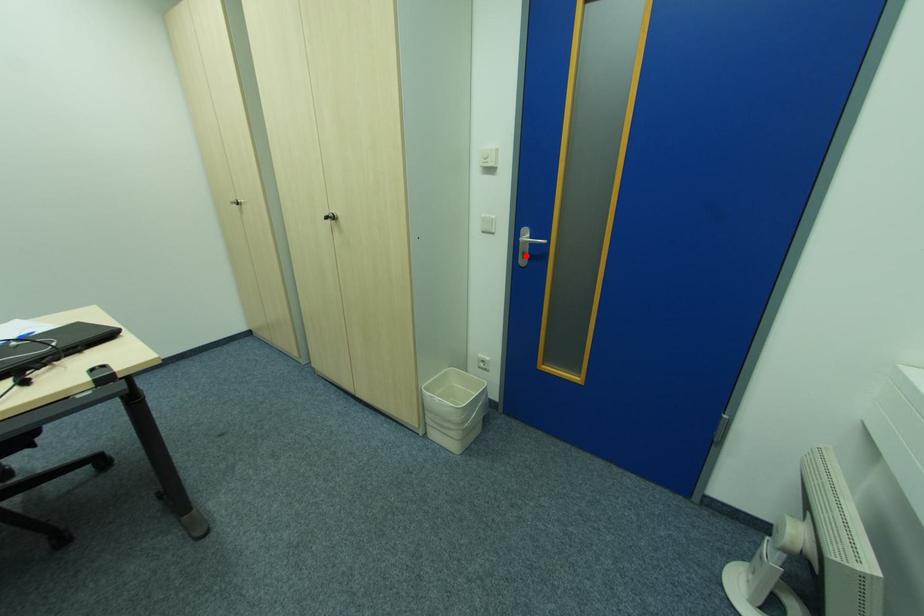
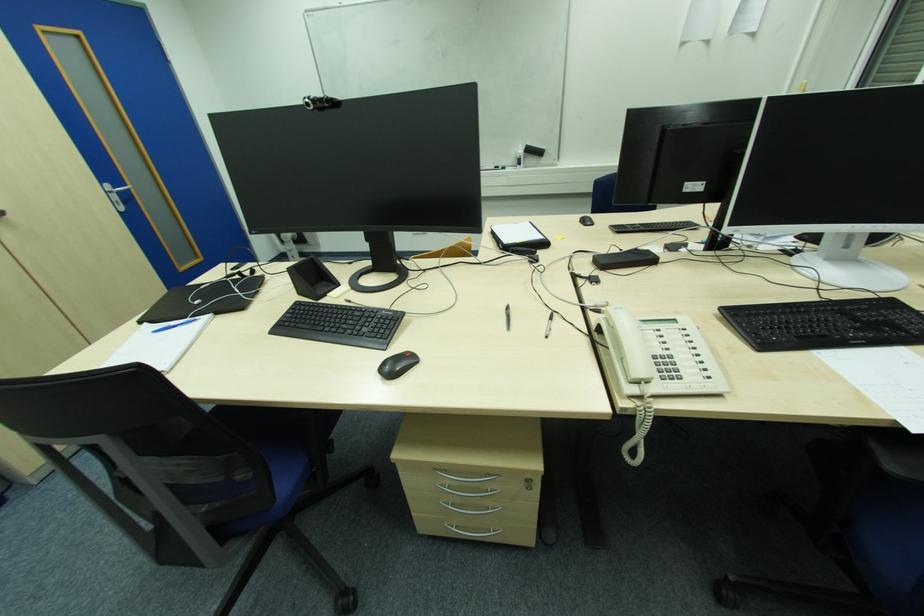
Question: I am providing you with two images of the same scene from different viewpoints. Image1 has a red point marked. In image2, the corresponding 3D location appears at what relative position? Reply with the corresponding letter.

Choices:
 (A) Closer
 (B) Farther

Answer: (B)